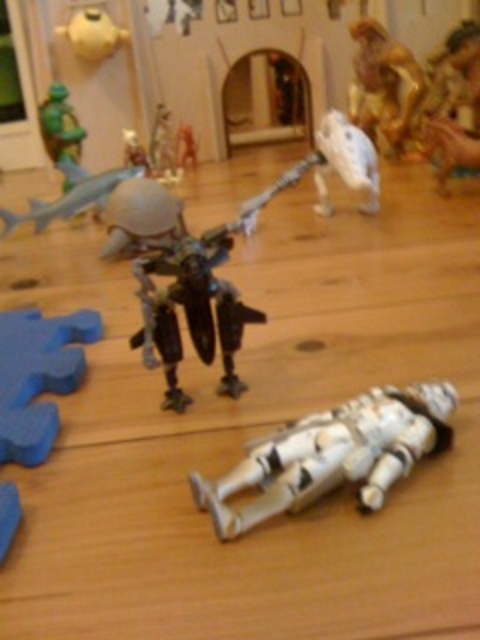
You are a child trying to reach the white plastic astronaut at lower center from where you are standing next to the stormtrooper. Can you grab it without moving your feet?

The distance between the white plastic astronaut at lower center and the stormtrooper is 54.17 centimeters. Since the child can typically reach about 50 centimeters from their standing position, they might need to take a small step forward to grab it.

Please use the coordinates provided to identify which object is located at point (200, 294) in the image. The available options are the white toy stormtrooper and the metallic silver robot.

The metallic silver robot at center is located at point (200, 294).